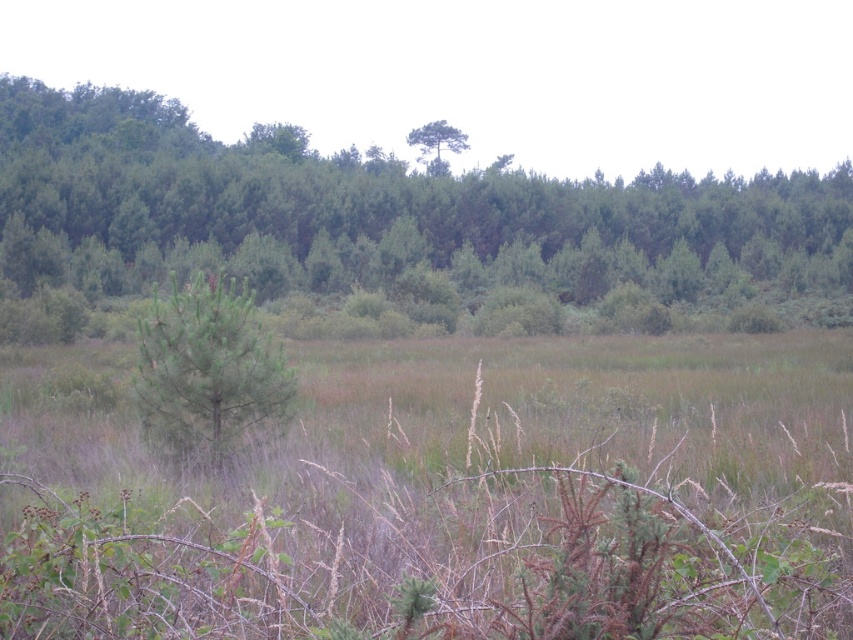
Question: Is green leafy tree at center smaller than green matte tree at center?

Choices:
 (A) no
 (B) yes

Answer: (A)

Question: Which object is positioned farthest from the green leafy tree at center?

Choices:
 (A) green matte tree at upper center
 (B) green matte tree at center

Answer: (B)

Question: Which is farther from the green matte tree at upper center?

Choices:
 (A) green leafy tree at center
 (B) green matte tree at center

Answer: (B)

Question: Is green matte tree at center positioned at the back of green matte tree at upper center?

Choices:
 (A) no
 (B) yes

Answer: (A)

Question: Which is nearer to the green matte tree at center?

Choices:
 (A) green leafy tree at center
 (B) green matte tree at upper center

Answer: (A)

Question: Can you confirm if green matte tree at center is smaller than green matte tree at upper center?

Choices:
 (A) no
 (B) yes

Answer: (B)